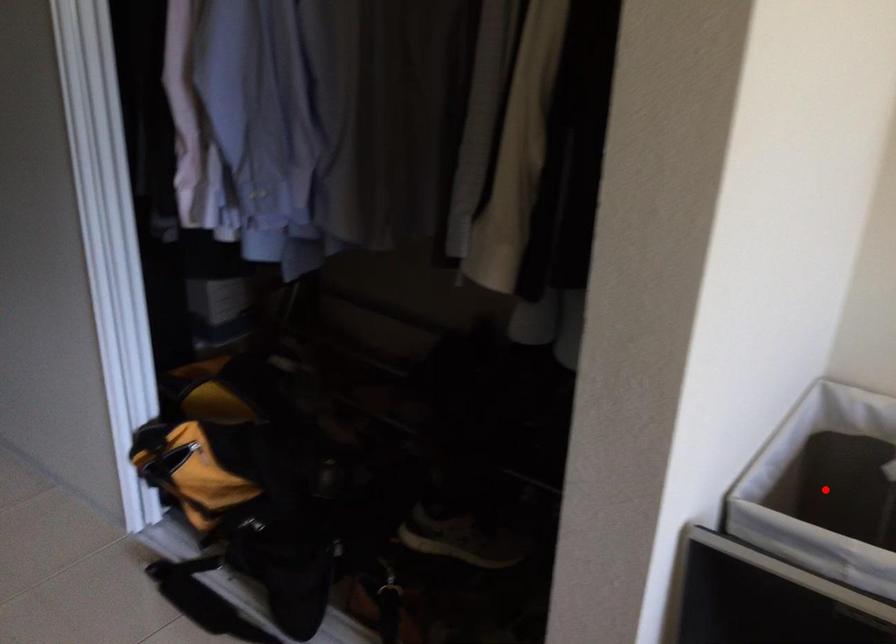
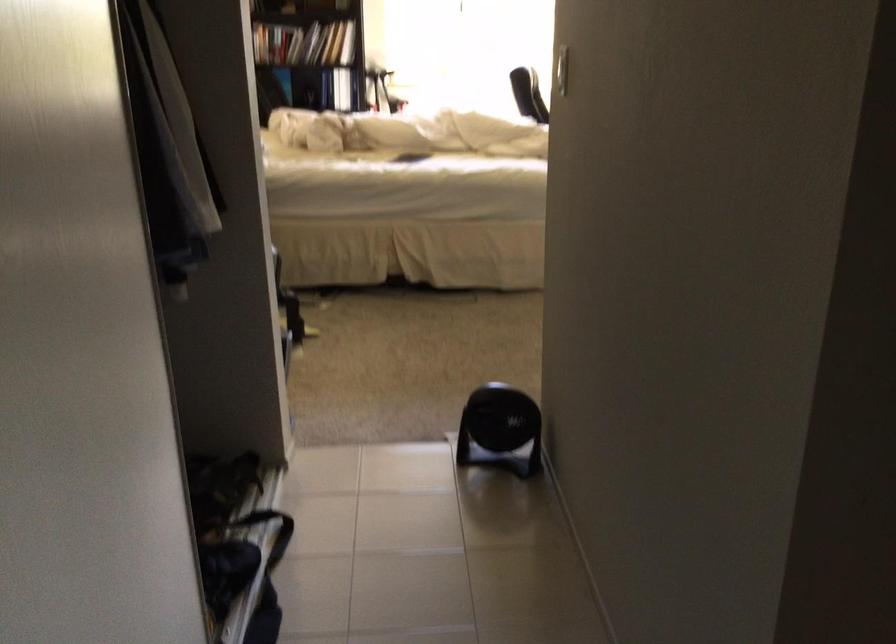
Question: I am providing you with two images of the same scene from different viewpoints. A red point is marked on the first image. Is the red point's position out of view in image 2?

Choices:
 (A) Yes
 (B) No

Answer: (A)